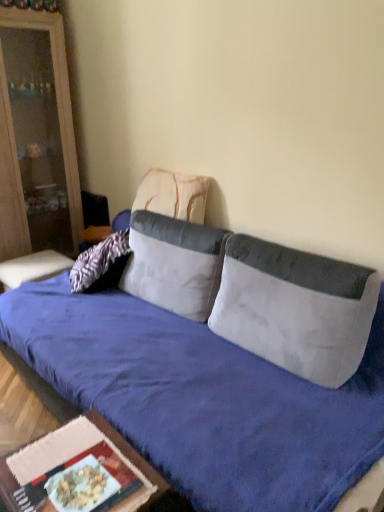
Question: Is matte wood cabinet at left to the left or to the right of textured beige pillow at center, marked as the first pillow in a back-to-front arrangement, in the image?

Choices:
 (A) right
 (B) left

Answer: (B)

Question: In terms of height, does matte wood cabinet at left look taller or shorter compared to textured beige pillow at center, marked as the first pillow in a back-to-front arrangement?

Choices:
 (A) short
 (B) tall

Answer: (B)

Question: Based on their relative distances, which object is nearer to the matte wood cabinet at left?

Choices:
 (A) white fabric pillow at center, arranged as the second pillow when viewed from the back
 (B) velvet blue studio couch at center
 (C) white fabric pillow at center, positioned as the 3th pillow in back-to-front order
 (D) textured beige pillow at center, the third pillow positioned from the front
 (E) wooden table at lower left

Answer: (D)

Question: Which object is the closest to the white fabric pillow at center, acting as the 2th pillow starting from the front?

Choices:
 (A) white fabric pillow at center, the first pillow in the front-to-back sequence
 (B) matte wood cabinet at left
 (C) textured beige pillow at center, the third pillow positioned from the front
 (D) velvet blue studio couch at center
 (E) wooden table at lower left

Answer: (C)